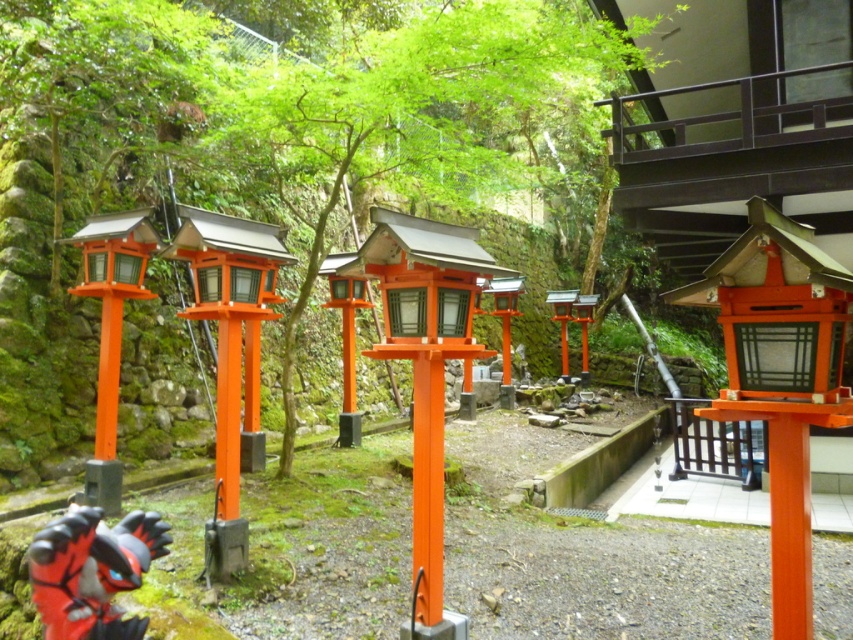
You are standing on the white tile floor at lower right and want to walk towards the black matte gate at center. Which direction should you move to reach it?

To reach the black matte gate at center from the white tile floor at lower right, you should move upward since the white tile floor at lower right is below the black matte gate at center.

You are standing at the entrance of the shrine and see two lanterns at the center. Which lantern is closer to you, the matte orange wooden lantern at center or the orange glossy lantern at center?

The matte orange wooden lantern at center is closer to you since it is in front of the orange glossy lantern at center.

You are standing at the entrance of the shrine and want to find the black matte gate at center. According to the coordinates provided, where should you look to locate it?

The black matte gate at center is located at coordinates point (714, 445), so you should look towards the lower right direction from your current position at the entrance.